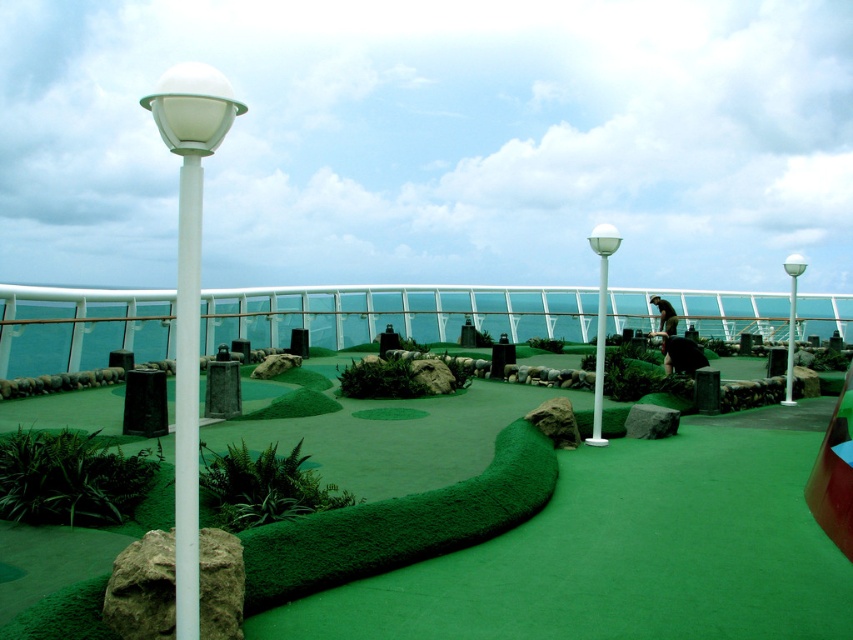
Question: Does white glossy lamp post at left have a lesser width compared to white glossy lamp post at center?

Choices:
 (A) yes
 (B) no

Answer: (A)

Question: Among these objects, which one is farthest from the camera?

Choices:
 (A) white glossy lamp post at left
 (B) green artificial turf at center
 (C) white plastic pole at left
 (D) white glossy lamp post at center

Answer: (D)

Question: Which point is farther from the camera taking this photo?

Choices:
 (A) (604, 346)
 (B) (323, 554)
 (C) (194, 417)

Answer: (A)

Question: Does white glossy lamp post at left appear under white glossy lamp post at center?

Choices:
 (A) no
 (B) yes

Answer: (A)

Question: Among these objects, which one is farthest from the camera?

Choices:
 (A) white plastic pole at left
 (B) white glossy lamp post at center

Answer: (B)

Question: Can you confirm if green artificial turf at center is positioned below white plastic lamp post at right?

Choices:
 (A) no
 (B) yes

Answer: (B)